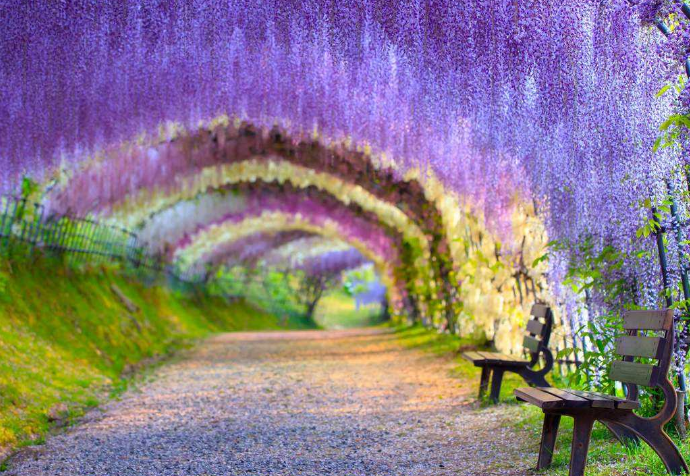
Where is `grey bench`? This screenshot has height=476, width=690. grey bench is located at coordinates (637, 367).